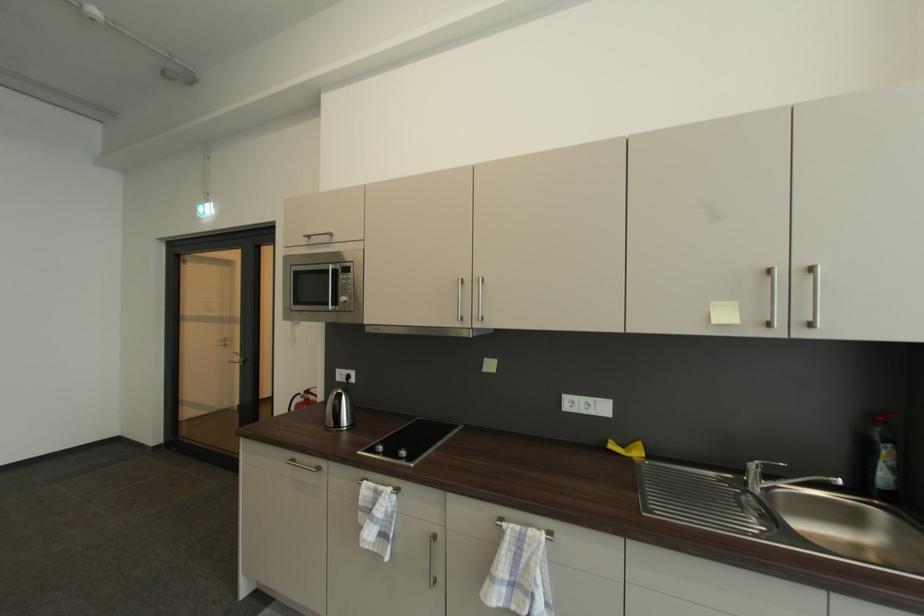
Describe the element at coordinates (341, 276) in the screenshot. This screenshot has height=616, width=924. I see `the microwave dial` at that location.